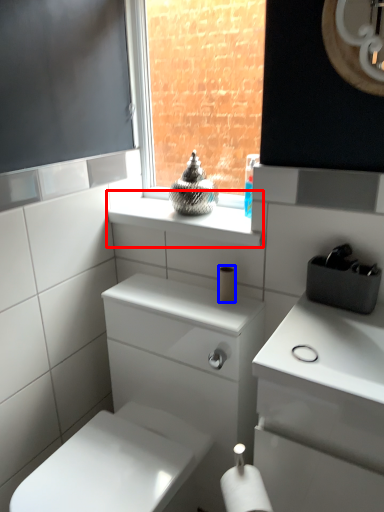
Question: Among these objects, which one is nearest to the camera, window sill (highlighted by a red box) or toilet paper (highlighted by a blue box)?

Choices:
 (A) window sill
 (B) toilet paper

Answer: (A)